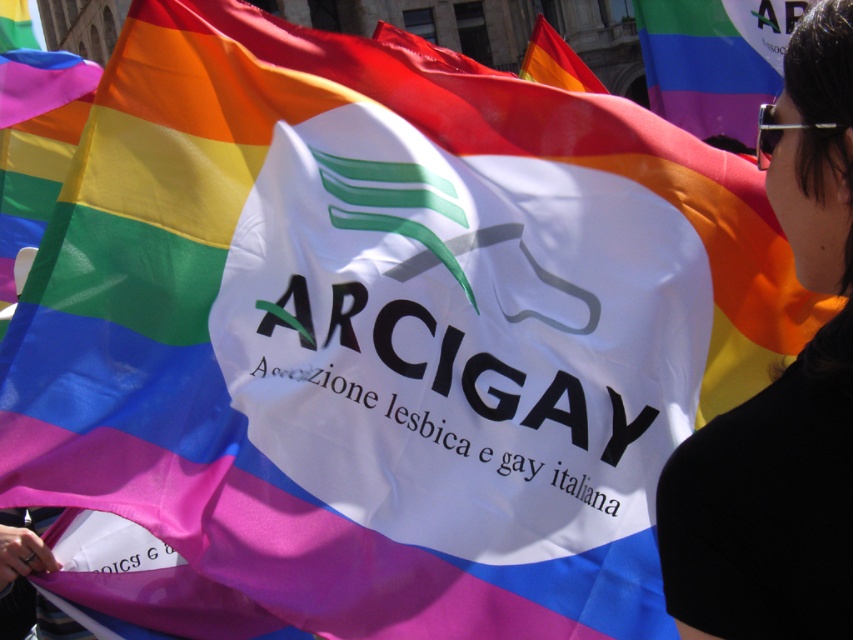
You are at a pride event and see the black fabric at upper right and the rainbow fabric flag at upper center. Which object is positioned to the right side of the other?

The black fabric at upper right is positioned to the right of the rainbow fabric flag at upper center.

You are attending a pride event and see the black fabric at upper right and the rainbow fabric flag at upper center. Which object is taller?

The rainbow fabric flag at upper center is taller than the black fabric at upper right.